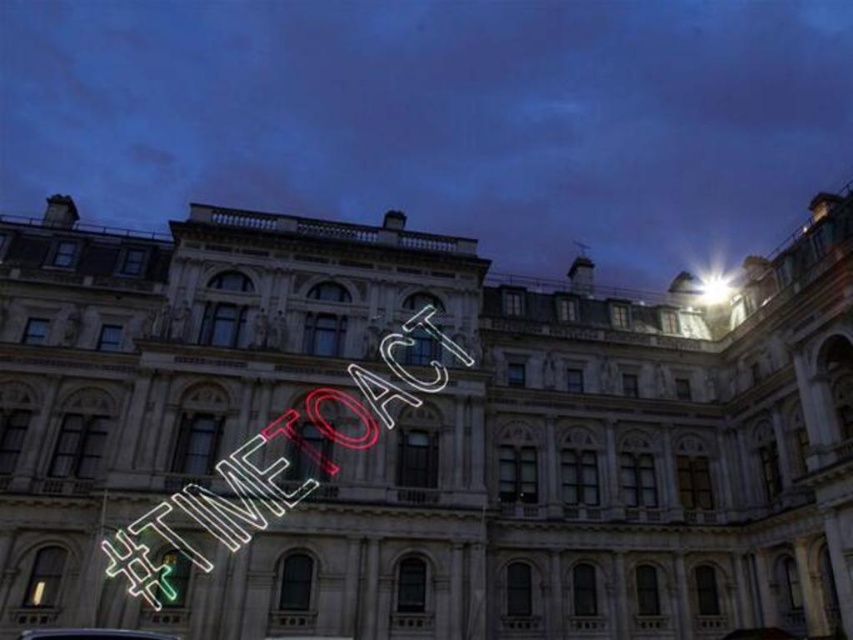
Question: Which point is closer to the camera?

Choices:
 (A) (102, 636)
 (B) (421, 328)

Answer: (A)

Question: Which of the following is the closest to the observer?

Choices:
 (A) (154, 632)
 (B) (335, 410)

Answer: (A)

Question: Does neon sign at center appear on the right side of shiny silver car at lower center?

Choices:
 (A) yes
 (B) no

Answer: (A)

Question: Observing the image, what is the correct spatial positioning of neon sign at center in reference to shiny silver car at lower center?

Choices:
 (A) below
 (B) above

Answer: (B)

Question: Can you confirm if neon sign at center is positioned below shiny silver car at lower center?

Choices:
 (A) no
 (B) yes

Answer: (A)